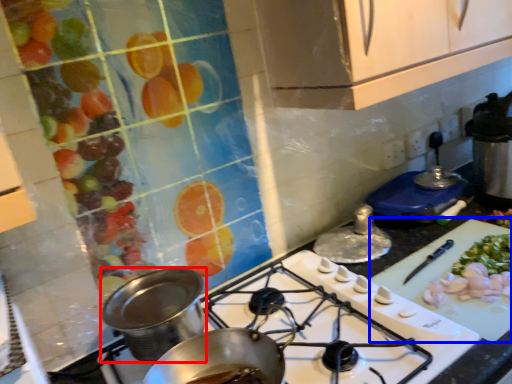
Question: Which object is closer to the camera taking this photo, kitchen appliance (highlighted by a red box) or cutting board (highlighted by a blue box)?

Choices:
 (A) kitchen appliance
 (B) cutting board

Answer: (A)